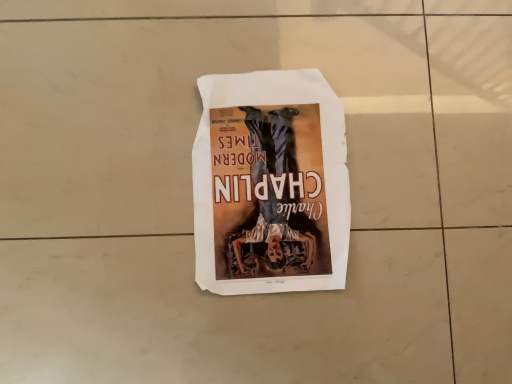
The width and height of the screenshot is (512, 384). I want to click on matte paper poster at center, so click(x=270, y=184).

What is the approximate width of matte paper poster at center?

12.14 inches.

The width and height of the screenshot is (512, 384). Describe the element at coordinates (270, 184) in the screenshot. I see `matte paper poster at center` at that location.

Find the location of a particular element. The height and width of the screenshot is (384, 512). matte paper poster at center is located at coordinates (270, 184).